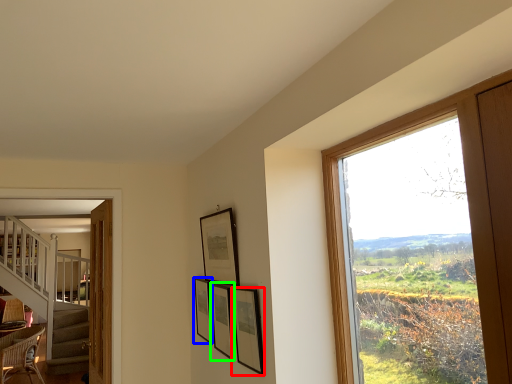
Question: Which object is positioned farthest from picture frame (highlighted by a red box)? Select from picture frame (highlighted by a blue box) and picture frame (highlighted by a green box).

Choices:
 (A) picture frame
 (B) picture frame

Answer: (A)